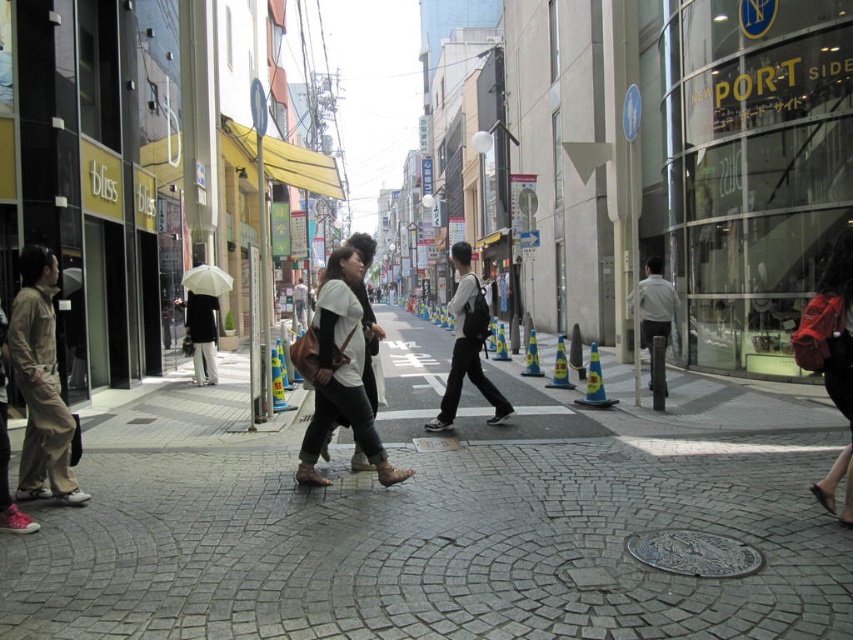
Looking at this image, you are a pedestrian standing on the sidewalk of the urban street scene. You see a matte black backpack at center and a light gray shirt at center. Which object is closer to your left side?

The matte black backpack at center is closer to your left side because it is positioned to the left of the light gray shirt at center.

You are a delivery person needing to quickly spot your items on the sidewalk. You have a matte pink backpack at lower right and a matte white shirt at center. Which item is shorter in height?

The matte pink backpack at lower right is not as tall as the matte white shirt at center, so the matte pink backpack at lower right is shorter in height.

You are a pedestrian standing at the crosswalk in the middle of the street. You see a matte pink backpack at lower right and a matte white shirt at center. Which object is closer to the right side of the street?

The matte pink backpack at lower right is closer to the right side of the street because it is positioned to the right of the matte white shirt at center.